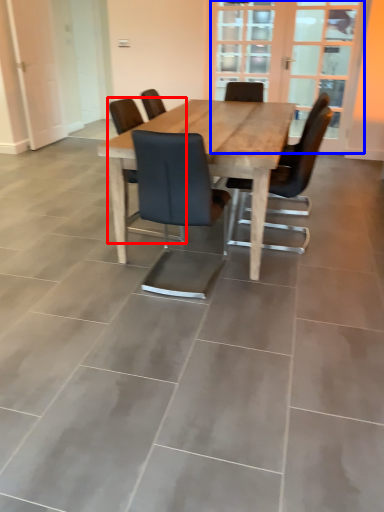
Question: Which object is further to the camera taking this photo, chair (highlighted by a red box) or screen door (highlighted by a blue box)?

Choices:
 (A) chair
 (B) screen door

Answer: (B)